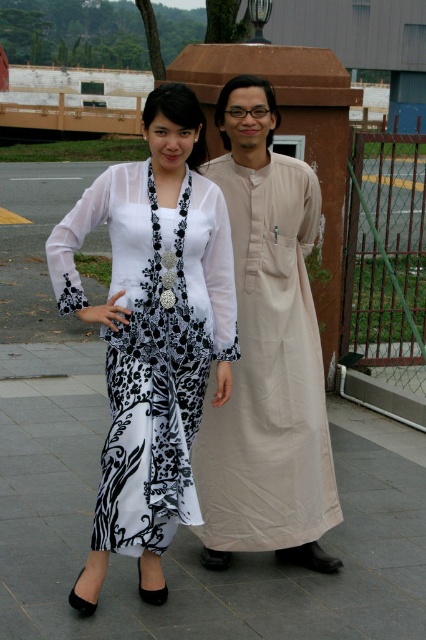
Between beige cotton robe at center and white sheer dress at center, which one has more height?

With more height is beige cotton robe at center.

Measure the distance from beige cotton robe at center to white sheer dress at center.

A distance of 19.29 inches exists between beige cotton robe at center and white sheer dress at center.

Between point (222, 193) and point (81, 211), which one is positioned behind?

The point (222, 193) is more distant.

Where is `beige cotton robe at center`? The height and width of the screenshot is (640, 426). beige cotton robe at center is located at coordinates (267, 355).

Who is positioned more to the left, white sheer blouse at upper left or black fabric skirt at lower center?

From the viewer's perspective, white sheer blouse at upper left appears more on the left side.

Is white sheer blouse at upper left shorter than black fabric skirt at lower center?

No, white sheer blouse at upper left is not shorter than black fabric skirt at lower center.

Is point (104, 572) less distant than point (362, 419)?

Yes, it is in front of point (362, 419).

Find the location of a particular element. white sheer blouse at upper left is located at coordinates (206, 342).

Which is above, black fabric skirt at lower center or beige cotton robe at center?

beige cotton robe at center is above.

Does point (135, 580) come in front of point (250, 212)?

Yes, it is.

At what (x,y) coordinates should I click in order to perform the action: click on black fabric skirt at lower center. Please return your answer as a coordinate pair (x, y). This screenshot has width=426, height=640. Looking at the image, I should click on (189, 532).

Where is `black fabric skirt at lower center`? The width and height of the screenshot is (426, 640). black fabric skirt at lower center is located at coordinates click(x=189, y=532).